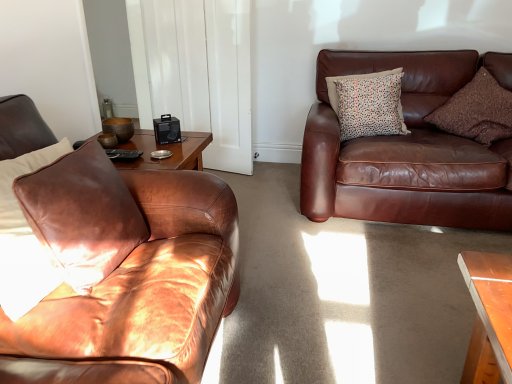
Locate an element on the screen. The image size is (512, 384). free space in front of brown leather couch at right, the second studio couch when ordered from left to right is located at coordinates (380, 294).